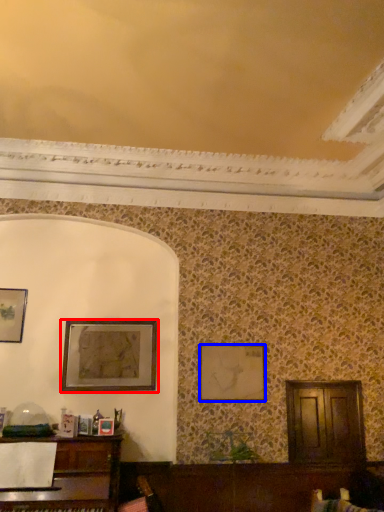
Question: Which object is closer to the camera taking this photo, picture frame (highlighted by a red box) or picture frame (highlighted by a blue box)?

Choices:
 (A) picture frame
 (B) picture frame

Answer: (A)